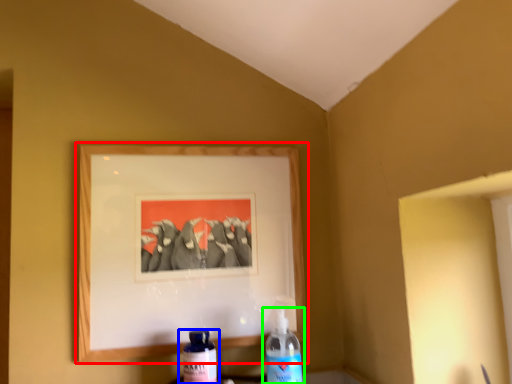
Question: Based on their relative distances, which object is nearer to picture frame (highlighted by a red box)? Choose from bottle (highlighted by a blue box) and bottle (highlighted by a green box).

Choices:
 (A) bottle
 (B) bottle

Answer: (B)